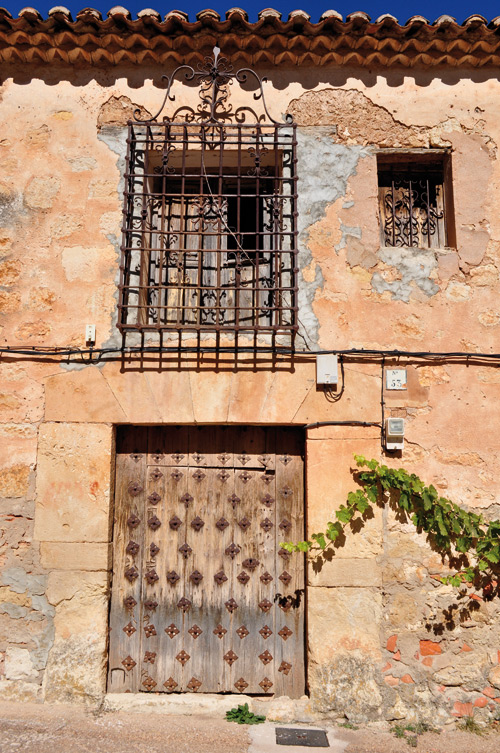
Where is `metal bars of windows`? metal bars of windows is located at coordinates (150, 202), (411, 206).